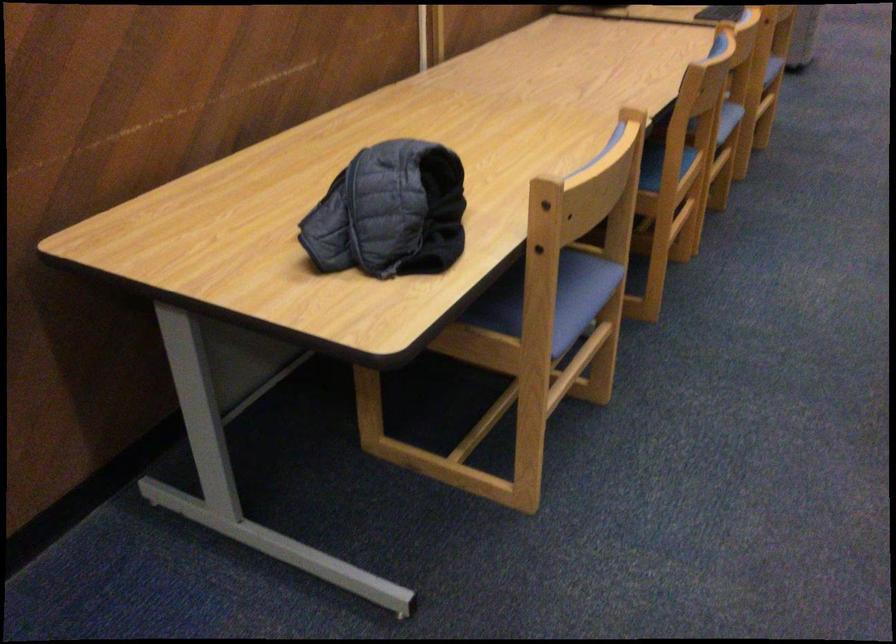
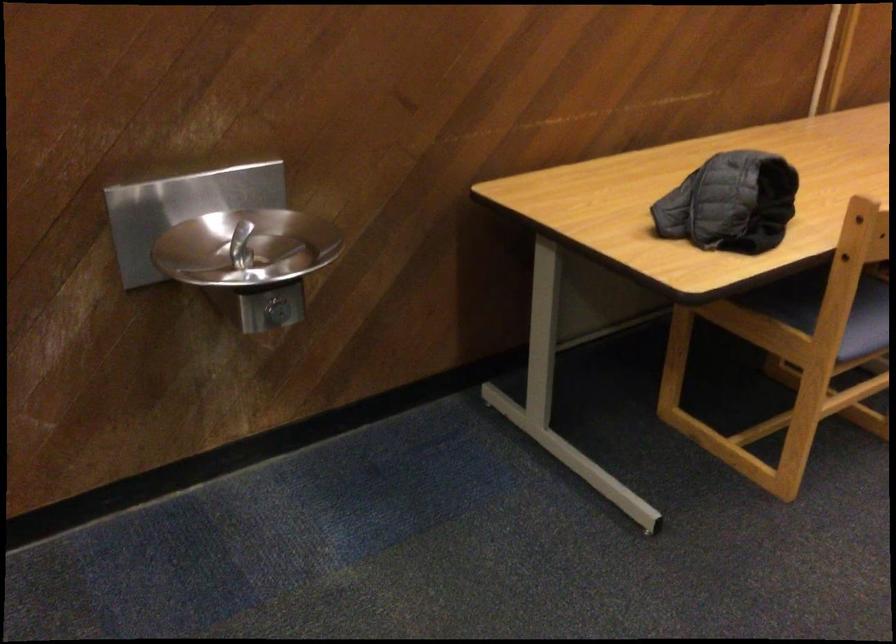
Question: The images are taken continuously from a first-person perspective. In which direction is your viewpoint rotating?

Choices:
 (A) Left
 (B) Right
 (C) Up
 (D) Down

Answer: (A)